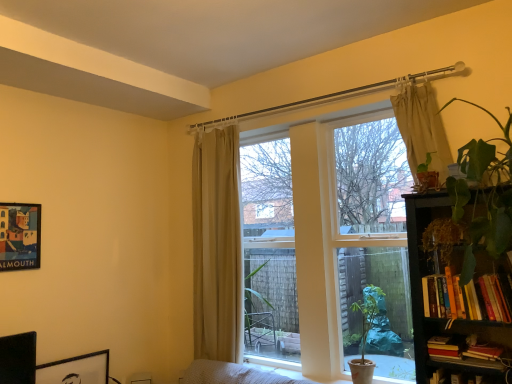
Measure the distance between point [448,350] and camera.

The depth of point [448,350] is 2.08 meters.

You are a GUI agent. You are given a task and a screenshot of the screen. Output one action in this format:
    pyautogui.click(x=<x>, y=<y>)
    Task: Click on the hardcover books at lower right, the first book positioned from the bottom
    The image size is (512, 384).
    Given the screenshot: What is the action you would take?
    pyautogui.click(x=464, y=352)

What do you see at coordinates (443, 318) in the screenshot?
I see `black matte bookcase at right` at bounding box center [443, 318].

You are a GUI agent. You are given a task and a screenshot of the screen. Output one action in this format:
    pyautogui.click(x=<x>, y=<y>)
    Task: Click on the green matte houseplant at lower right
    The width and height of the screenshot is (512, 384).
    Given the screenshot: What is the action you would take?
    pyautogui.click(x=366, y=333)

At what (x,y) coordinates should I click in order to perform the action: click on hardcover books at lower right, which is the third book from bottom to top. Please return your answer as a coordinate pair (x, y). Looking at the image, I should click on (445, 346).

Which object is further away from the camera, hardcover books at lower right, which is the third book from bottom to top, or green matte houseplant at lower right?

green matte houseplant at lower right is more distant.

From a real-world perspective, which is physically above, hardcover books at lower right, which is the 2th book in top-to-bottom order, or green matte houseplant at lower right?

hardcover books at lower right, which is the 2th book in top-to-bottom order.

Does hardcover books at lower right, which is the third book from bottom to top, appear on the right side of green matte houseplant at lower right?

Indeed, hardcover books at lower right, which is the third book from bottom to top, is positioned on the right side of green matte houseplant at lower right.

In the scene shown: From the image's perspective, which is below, hardcover books at lower right, which is the third book from bottom to top, or green matte houseplant at lower right?

green matte houseplant at lower right is shown below in the image.

Is matte beige curtains at center positioned in front of matte paper picture frame at upper left, positioned as the first picture frame in top-to-bottom order?

Yes, the depth of matte beige curtains at center is less than that of matte paper picture frame at upper left, positioned as the first picture frame in top-to-bottom order.

Between matte beige curtains at center and matte paper picture frame at upper left, which ranks as the second picture frame in bottom-to-top order, which one has more height?

matte beige curtains at center is taller.

Would you consider matte beige curtains at center to be distant from matte paper picture frame at upper left, positioned as the first picture frame in top-to-bottom order?

That's right, there is a large distance between matte beige curtains at center and matte paper picture frame at upper left, positioned as the first picture frame in top-to-bottom order.

Is matte beige curtains at center situated inside matte paper picture frame at upper left, which ranks as the second picture frame in bottom-to-top order, or outside?

matte beige curtains at center is not enclosed by matte paper picture frame at upper left, which ranks as the second picture frame in bottom-to-top order.

Is hardcover books at lower right, the first book positioned from the bottom, facing towards black matte picture frame at lower left, the second picture frame from the left?

No, hardcover books at lower right, the first book positioned from the bottom, is not aimed at black matte picture frame at lower left, the second picture frame from the left.

Considering the positions of point (432, 338) and point (64, 360), is point (432, 338) closer or farther from the camera than point (64, 360)?

Point (432, 338).

Which object is wider, hardcover books at lower right, which is the fourth book in top-to-bottom order, or black matte picture frame at lower left, the second picture frame from the left?

hardcover books at lower right, which is the fourth book in top-to-bottom order.

Relative to black matte picture frame at lower left, the second picture frame from the left, is hardcover books at lower right, which is the fourth book in top-to-bottom order, in front or behind?

Visually, hardcover books at lower right, which is the fourth book in top-to-bottom order, is located in front of black matte picture frame at lower left, the second picture frame from the left.

Is point (105, 352) closer or farther from the camera than point (2, 218)?

Point (105, 352) is positioned farther from the camera compared to point (2, 218).

Is black matte picture frame at lower left, the second picture frame positioned from the top, to the left of matte paper picture frame at upper left, which ranks as the second picture frame in bottom-to-top order, from the viewer's perspective?

In fact, black matte picture frame at lower left, the second picture frame positioned from the top, is to the right of matte paper picture frame at upper left, which ranks as the second picture frame in bottom-to-top order.

Measure the distance between black matte picture frame at lower left, the second picture frame from the left, and matte paper picture frame at upper left, which is the 1th picture frame from left to right.

black matte picture frame at lower left, the second picture frame from the left, is 32.88 inches from matte paper picture frame at upper left, which is the 1th picture frame from left to right.

Would you say black matte picture frame at lower left, the second picture frame positioned from the top, is a long distance from matte paper picture frame at upper left, which is the 1th picture frame from left to right?

black matte picture frame at lower left, the second picture frame positioned from the top, is actually quite close to matte paper picture frame at upper left, which is the 1th picture frame from left to right.

Between black matte bookcase at right and matte paper picture frame at upper left, the second picture frame from the right, which one has larger size?

black matte bookcase at right.

Which of these two, black matte bookcase at right or matte paper picture frame at upper left, which is the 1th picture frame from left to right, is thinner?

matte paper picture frame at upper left, which is the 1th picture frame from left to right, is thinner.

What's the angular difference between black matte bookcase at right and matte paper picture frame at upper left, positioned as the first picture frame in top-to-bottom order,'s facing directions?

87.9 degrees separate the facing orientations of black matte bookcase at right and matte paper picture frame at upper left, positioned as the first picture frame in top-to-bottom order.

Would you say matte paper picture frame at upper left, the second picture frame from the right, is part of black matte bookcase at right's contents?

No, matte paper picture frame at upper left, the second picture frame from the right, is not a part of black matte bookcase at right.

Looking at this image, is the surface of hardcover book at lower right, acting as the 3th book starting from the top, in direct contact with black matte picture frame at lower left, marked as the first picture frame in a right-to-left arrangement?

No, hardcover book at lower right, acting as the 3th book starting from the top, is not in contact with black matte picture frame at lower left, marked as the first picture frame in a right-to-left arrangement.

Between hardcover book at lower right, acting as the 3th book starting from the top, and black matte picture frame at lower left, marked as the first picture frame in a right-to-left arrangement, which one has larger width?

hardcover book at lower right, acting as the 3th book starting from the top.

Is hardcover book at lower right, acting as the 3th book starting from the top, oriented towards black matte picture frame at lower left, the second picture frame from the left?

No, hardcover book at lower right, acting as the 3th book starting from the top, is not facing towards black matte picture frame at lower left, the second picture frame from the left.

Can you confirm if hardcover book at lower right, which is counted as the second book, starting from the bottom, is positioned to the right of black matte picture frame at lower left, the second picture frame from the left?

Yes.

Based on their sizes in the image, would you say beige fabric curtain at upper right, the 2th curtain viewed from the back, is bigger or smaller than beige fabric curtain at center, arranged as the 1th curtain when viewed from the left?

In the image, beige fabric curtain at upper right, the 2th curtain viewed from the back, appears to be smaller than beige fabric curtain at center, arranged as the 1th curtain when viewed from the left.

From a real-world perspective, who is located higher, beige fabric curtain at upper right, acting as the first curtain starting from the front, or beige fabric curtain at center, positioned as the first curtain in back-to-front order?

beige fabric curtain at upper right, acting as the first curtain starting from the front, is physically above.

Image resolution: width=512 pixels, height=384 pixels. I want to click on curtain lying behind the beige fabric curtain at upper right, the 2th curtain when ordered from left to right, so click(217, 245).

Is beige fabric curtain at center, the second curtain viewed from the right, at the back of beige fabric curtain at upper right, marked as the first curtain in a right-to-left arrangement?

No, beige fabric curtain at upper right, marked as the first curtain in a right-to-left arrangement, is not facing the opposite direction of beige fabric curtain at center, the second curtain viewed from the right.

The image size is (512, 384). There is a green matte houseplant at lower right. What are the coordinates of `the 3rd book above it (from the image's perspective)` in the screenshot? It's located at (445, 346).

You are a GUI agent. You are given a task and a screenshot of the screen. Output one action in this format:
    pyautogui.click(x=<x>, y=<y>)
    Task: Click on the window located on the right of matte paper picture frame at upper left, which is the 1th picture frame from left to right
    The image size is (512, 384).
    Given the screenshot: What is the action you would take?
    pyautogui.click(x=320, y=239)

Looking at the image, which one is located closer to black matte picture frame at lower left, which is the first picture frame in bottom-to-top order, hardcover book at lower right, acting as the 3th book starting from the top, or black matte bookcase at right?

Among the two, black matte bookcase at right is located nearer to black matte picture frame at lower left, which is the first picture frame in bottom-to-top order.

From the image, which object appears to be nearer to hardcover books at right, acting as the 1th book starting from the top, beige fabric curtain at upper right, marked as the first curtain in a right-to-left arrangement, or black matte picture frame at lower left, which is the first picture frame in bottom-to-top order?

beige fabric curtain at upper right, marked as the first curtain in a right-to-left arrangement.

Which object lies nearer to the anchor point matte beige curtains at center, matte paper picture frame at upper left, which is the 1th picture frame from left to right, or beige fabric curtain at center, the second curtain viewed from the right?

The object closer to matte beige curtains at center is beige fabric curtain at center, the second curtain viewed from the right.

When comparing their distances from black matte picture frame at lower left, marked as the first picture frame in a right-to-left arrangement, does hardcover books at right, acting as the 1th book starting from the top, or matte beige curtains at center seem further?

hardcover books at right, acting as the 1th book starting from the top, lies further to black matte picture frame at lower left, marked as the first picture frame in a right-to-left arrangement, than the other object.

Considering their positions, is green matte houseplant at lower right positioned further to hardcover books at right, acting as the 1th book starting from the top, than black matte picture frame at lower left, the second picture frame positioned from the top?

black matte picture frame at lower left, the second picture frame positioned from the top, is further to hardcover books at right, acting as the 1th book starting from the top.

Estimate the real-world distances between objects in this image. Which object is closer to matte beige curtains at center, black matte bookcase at right or hardcover book at lower right, which is counted as the second book, starting from the bottom?

Among the two, black matte bookcase at right is located nearer to matte beige curtains at center.

Based on their spatial positions, is hardcover books at lower right, which is the third book from bottom to top, or hardcover book at lower right, which is counted as the second book, starting from the bottom, closer to black matte picture frame at lower left, the second picture frame from the left?

hardcover books at lower right, which is the third book from bottom to top, is positioned closer to the anchor black matte picture frame at lower left, the second picture frame from the left.

Looking at the image, which one is located closer to matte paper picture frame at upper left, the second picture frame from the right, beige fabric curtain at upper right, acting as the first curtain starting from the front, or hardcover books at right, acting as the 1th book starting from the top?

Among the two, beige fabric curtain at upper right, acting as the first curtain starting from the front, is located nearer to matte paper picture frame at upper left, the second picture frame from the right.

Image resolution: width=512 pixels, height=384 pixels. What are the coordinates of `window between beige fabric curtain at upper right, the 2th curtain viewed from the back, and black matte bookcase at right vertically` in the screenshot? It's located at (320, 239).

You are a GUI agent. You are given a task and a screenshot of the screen. Output one action in this format:
    pyautogui.click(x=<x>, y=<y>)
    Task: Click on the book between matte paper picture frame at upper left, which ranks as the second picture frame in bottom-to-top order, and hardcover books at right, placed as the 4th book when sorted from bottom to top, in the horizontal direction
    Image resolution: width=512 pixels, height=384 pixels.
    Given the screenshot: What is the action you would take?
    pyautogui.click(x=445, y=346)

This screenshot has height=384, width=512. Identify the location of window between matte paper picture frame at upper left, which ranks as the second picture frame in bottom-to-top order, and beige fabric curtain at upper right, the 2th curtain viewed from the back. (x=320, y=239).

The image size is (512, 384). I want to click on window situated between beige fabric curtain at center, arranged as the 1th curtain when viewed from the left, and green matte houseplant at lower right from left to right, so click(320, 239).